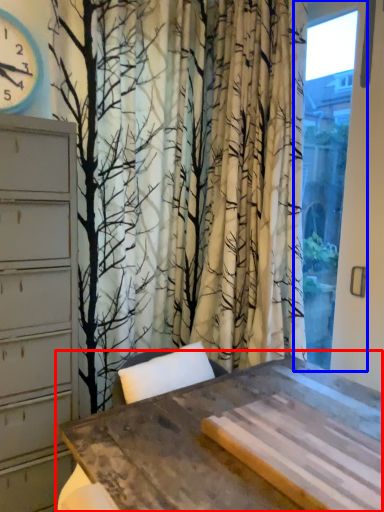
Question: Which object is further to the camera taking this photo, table (highlighted by a red box) or window (highlighted by a blue box)?

Choices:
 (A) table
 (B) window

Answer: (B)